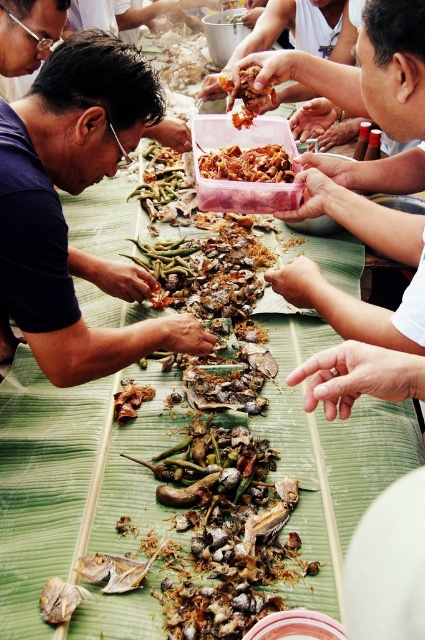
You are at a communal meal and need to pass a dish from the dark blue shirt at left to the shiny brown meat at center. Which object should you move first to ensure the dish reaches its destination?

The dark blue shirt at left is bigger than the shiny brown meat at center, so you should move the shiny brown meat at center first to make space before passing the dish to the dark blue shirt at left.

You are at a communal meal and want to grab the shiny brown meat at center. However, there is also a spicy brown meat at center nearby. How far apart are these two meats?

The shiny brown meat at center and spicy brown meat at center are 7.31 inches apart.

You are at the communal meal and want to hand a plate of food to the person wearing the dark blue shirt at left. Based on their position, where should you aim to place the plate?

You should aim to place the plate near the dark blue shirt at left at point (x=74, y=195).